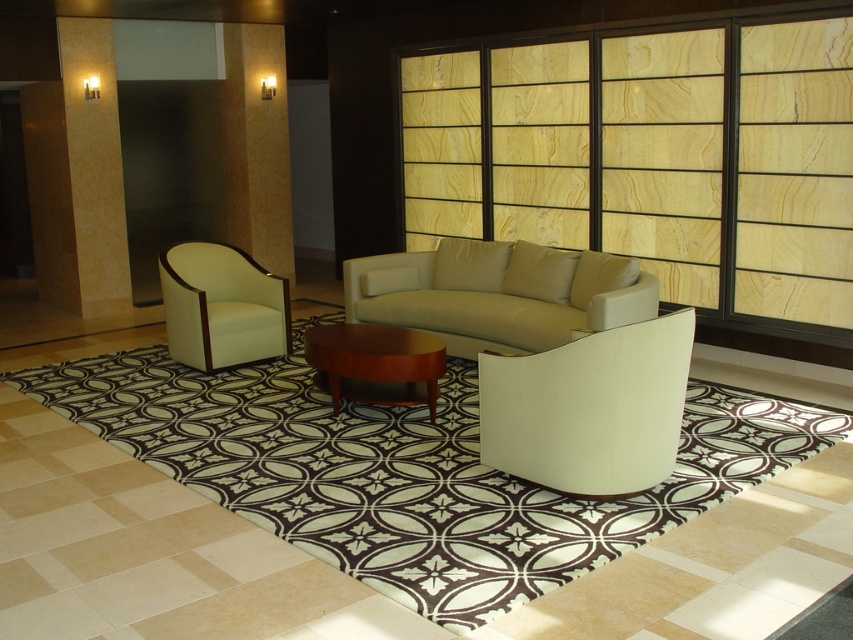
You are designing a layout for a small apartment and need to place the white leather armchair at left and the mahogany wood coffee table at center. If the space available is only slightly bigger than the armchair, will the coffee table fit comfortably?

The white leather armchair at left is larger in size than the mahogany wood coffee table at center, so the coffee table will fit comfortably in the space since it is smaller than the armchair.

You are sitting on the sofa and want to move to the white leather armchair at left. Which direction should you turn to face the white leather chair at center?

Since the white leather chair at center is to the right of the white leather armchair at left, you should turn to your right to face the white leather chair at center.

From the picture: You are sitting on the sofa and want to reach the mahogany wood coffee table at center. Which direction should you move to avoid the white leather armchair at left?

You should move to the right to avoid the white leather armchair at left, since the white leather armchair at left is located to the left of the mahogany wood coffee table at center.